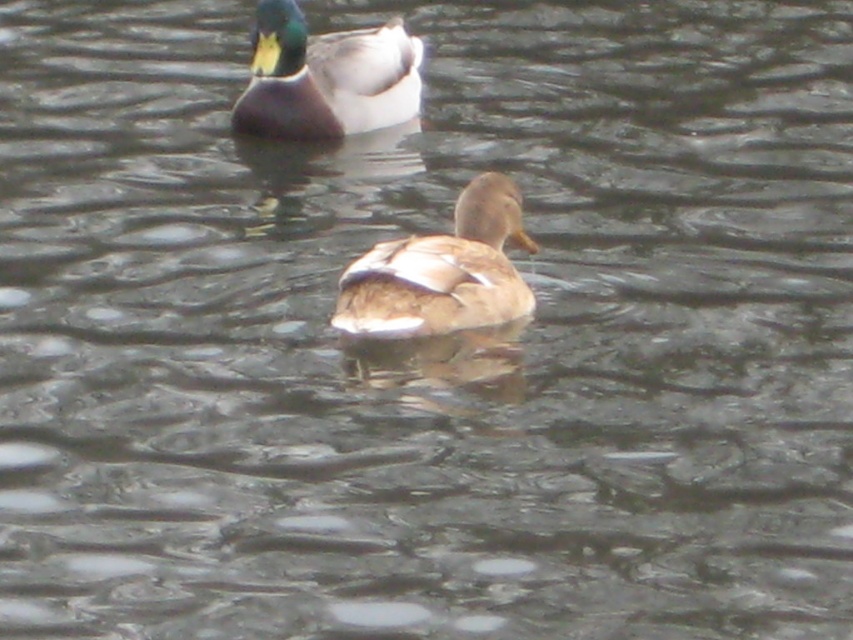
You are observing two ducks on the water. Based on their positions, which duck, the brown matte duck at center or the shiny green and brown duck at upper center, is closer to you?

The brown matte duck at center has a lesser height compared to the shiny green and brown duck at upper center, which means it is closer to you.

You are standing on the edge of the water and want to locate the brown matte duck at center. According to the coordinates provided, where would you look relative to your position?

The brown matte duck at center is located at point coordinates (442, 272), which means it is positioned slightly to the right and a bit forward from your current position on the edge of the water.

You are standing on the lakeside and see the brown matte duck at center and the shiny green and brown duck at upper center. Which duck is closer to you?

The brown matte duck at center is closer to you because it is positioned below the shiny green and brown duck at upper center, indicating it is in a lower plane and thus nearer in the visual perspective.